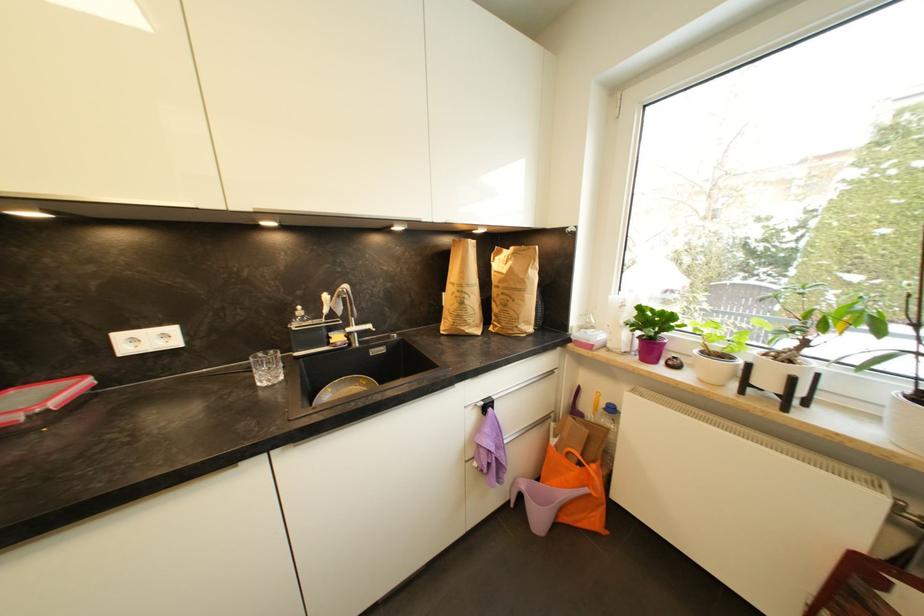
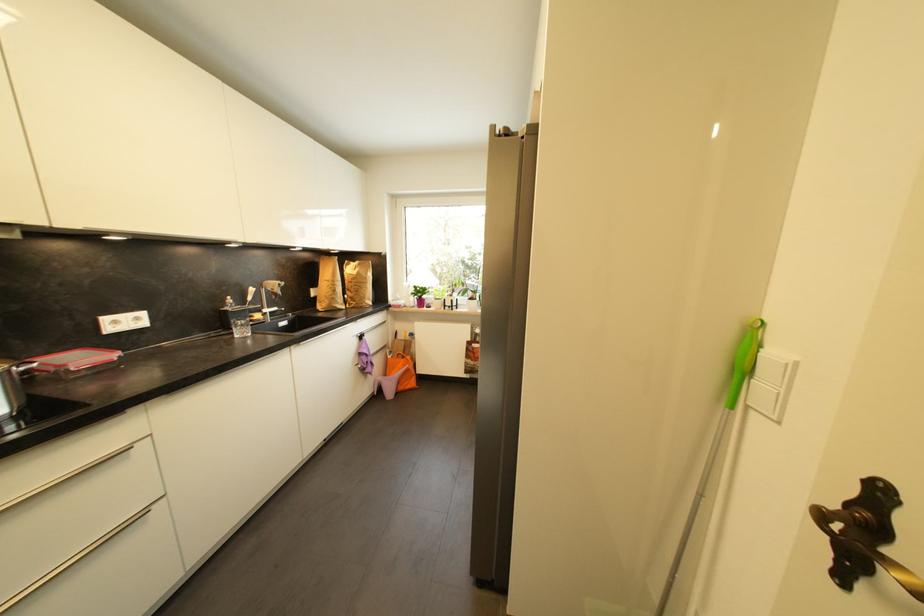
Where in the second image is the point corresponding to point (55, 381) from the first image?

(54, 355)